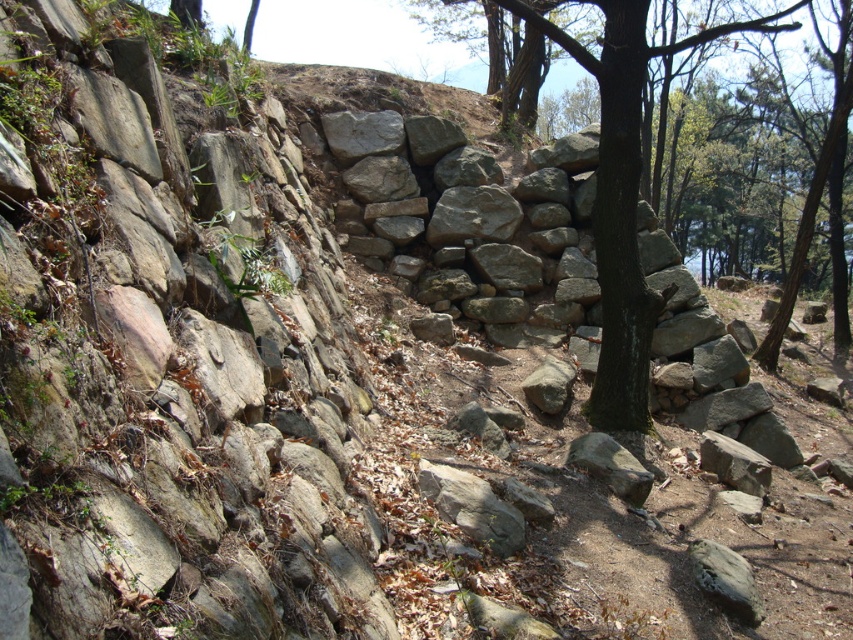
Question: Which point is farther to the camera?

Choices:
 (A) green rough bark tree at center
 (B) natural stone wall at left

Answer: (A)

Question: Can you confirm if natural stone wall at left is positioned to the left of green rough bark tree at center?

Choices:
 (A) no
 (B) yes

Answer: (B)

Question: Among these objects, which one is farthest from the camera?

Choices:
 (A) natural stone wall at left
 (B) green rough bark tree at center

Answer: (B)

Question: Which object is farther from the camera taking this photo?

Choices:
 (A) green rough bark tree at center
 (B) natural stone wall at left

Answer: (A)

Question: Can you confirm if natural stone wall at left is smaller than green rough bark tree at center?

Choices:
 (A) no
 (B) yes

Answer: (B)

Question: Can you confirm if natural stone wall at left is positioned above green rough bark tree at center?

Choices:
 (A) no
 (B) yes

Answer: (A)